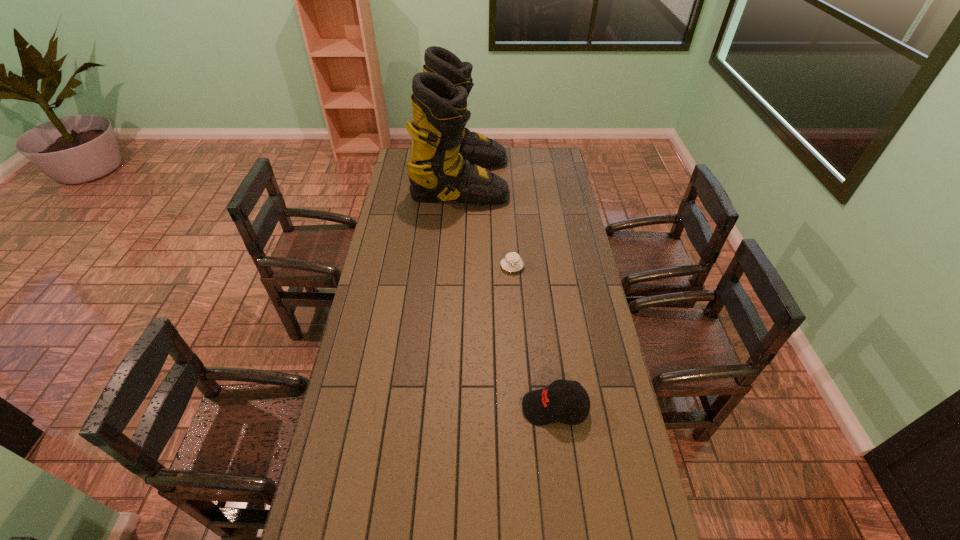
The width and height of the screenshot is (960, 540). Identify the location of vacant region located 0.240m on the side with the handle of the second nearest object. (516, 320).

This screenshot has height=540, width=960. I want to click on object that is at the far edge, so click(x=447, y=162).

What are the coordinates of `object that is positioned at the left edge` in the screenshot? It's located at point(447,162).

I want to click on object present at the right edge, so click(540, 407).

At what (x,y) coordinates should I click in order to perform the action: click on object positioned at the far left corner. Please return your answer as a coordinate pair (x, y). The image size is (960, 540). Looking at the image, I should click on (447, 162).

The height and width of the screenshot is (540, 960). What are the coordinates of `vacant point at the far edge` in the screenshot? It's located at (517, 168).

Identify the location of blank space at the left edge. This screenshot has width=960, height=540. (399, 219).

At what (x,y) coordinates should I click in order to perform the action: click on vacant position at the right edge of the desktop. Please return your answer as a coordinate pair (x, y). Looking at the image, I should click on (571, 319).

This screenshot has width=960, height=540. Identify the location of free space between the teacup and the farthest object. (487, 224).

Where is `vacant area that lies between the ski boots and the baseball cap`? This screenshot has width=960, height=540. vacant area that lies between the ski boots and the baseball cap is located at coordinates 508,294.